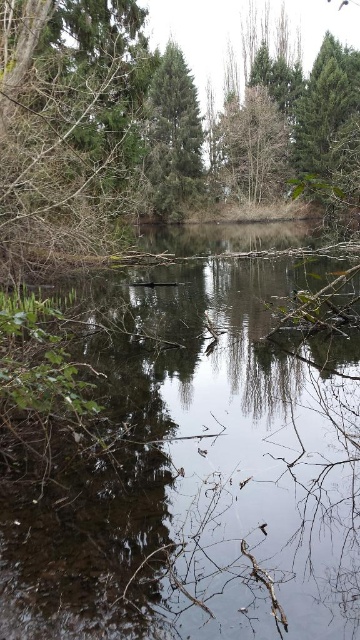
You are a small boat that is 1 meter wide. You want to sail from the transparent water at center to the green matte tree at upper left. Is there enough space between them for your boat to pass through?

The transparent water at center might be wider than green matte tree at upper left, so there is likely enough space for the boat to pass through as the width of the water could accommodate the boat.

You are an environmental scientist analyzing the pond. You need to determine which area covers more space in the image between the transparent water at center and the green matte tree at upper left. Based on the scene, which one is larger?

The transparent water at center is larger in size than the green matte tree at upper left, so the water covers more space in the image.

You are standing at the edge of the pond and want to take a photo of the green matte tree at upper left. If your camera has a maximum zoom range of 30 feet, will you be able to capture the tree clearly without moving closer?

The green matte tree at upper left is 29.94 feet away from the camera, which is within the camera maximum zoom range of 30 feet. Therefore, you can capture the tree clearly without moving closer.